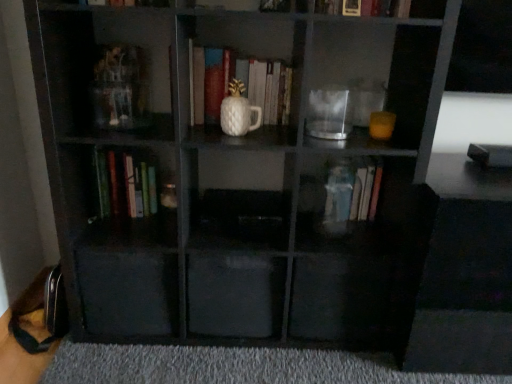
This screenshot has width=512, height=384. Identify the location of transparent plastic book at center, the first book positioned from the right. (353, 191).

The width and height of the screenshot is (512, 384). Describe the element at coordinates (230, 367) in the screenshot. I see `gray carpet at lower center` at that location.

The width and height of the screenshot is (512, 384). Identify the location of transparent plastic drawer at center, arranged as the 1th drawer when viewed from the right. (234, 295).

Considering the sizes of gray carpet at lower center and white matte vase at center, which is the second book from left to right, in the image, is gray carpet at lower center wider or thinner than white matte vase at center, which is the second book from left to right,?

In the image, gray carpet at lower center appears to be wider than white matte vase at center, which is the second book from left to right.

Looking at this image, from the image's perspective, who appears lower, gray carpet at lower center or white matte vase at center, acting as the third book starting from the right?

gray carpet at lower center.

Can you tell me how much gray carpet at lower center and white matte vase at center, which is the second book from left to right, differ in facing direction?

The angle between the facing direction of gray carpet at lower center and the facing direction of white matte vase at center, which is the second book from left to right, is 91.9 degrees.

Consider the image. Would you say gray carpet at lower center contains white matte vase at center, acting as the third book starting from the right?

That's incorrect, white matte vase at center, acting as the third book starting from the right, is not inside gray carpet at lower center.

Based on the photo, which of these two, hardcover book at upper center, positioned as the third book in left-to-right order, or transparent plastic drawer at lower left, which is the second drawer from right to left, stands taller?

With more height is transparent plastic drawer at lower left, which is the second drawer from right to left.

Identify the location of the 4th book directly above the transparent plastic drawer at lower left, which is the second drawer from right to left (from a real-world perspective). The width and height of the screenshot is (512, 384). (364, 7).

Is hardcover book at upper center, positioned as the third book in left-to-right order, not close to transparent plastic drawer at lower left, the 1th drawer when ordered from left to right?

That's right, there is a large distance between hardcover book at upper center, positioned as the third book in left-to-right order, and transparent plastic drawer at lower left, the 1th drawer when ordered from left to right.

In the scene shown: Does hardcover book at upper center, the second book from the right, have a smaller size compared to transparent plastic drawer at lower left, the 1th drawer when ordered from left to right?

Indeed, hardcover book at upper center, the second book from the right, has a smaller size compared to transparent plastic drawer at lower left, the 1th drawer when ordered from left to right.

Looking at this image, which point is more forward, (343, 124) or (155, 318)?

The point (343, 124) is closer to the camera.

How different are the orientations of transparent glass jar at center and transparent plastic drawer at lower left, which is the second drawer from right to left, in degrees?

They differ by 3.97 degrees in their facing directions.

Is transparent glass jar at center shorter than transparent plastic drawer at lower left, the 1th drawer when ordered from left to right?

Yes, transparent glass jar at center is shorter than transparent plastic drawer at lower left, the 1th drawer when ordered from left to right.

Starting from the transparent glass jar at center, which drawer is the 1st one behind? Please provide its 2D coordinates.

[(128, 292)]

Is transparent plastic book at center, the first book positioned from the right, touching white matte vase at center, acting as the third book starting from the right?

No, transparent plastic book at center, the first book positioned from the right, is not touching white matte vase at center, acting as the third book starting from the right.

Is transparent plastic book at center, the first book positioned from the right, oriented towards white matte vase at center, acting as the third book starting from the right?

No, transparent plastic book at center, the first book positioned from the right, does not turn towards white matte vase at center, acting as the third book starting from the right.

Is transparent plastic book at center, the first book positioned from the right, to the left or to the right of white matte vase at center, which is the second book from left to right, in the image?

transparent plastic book at center, the first book positioned from the right, is positioned on white matte vase at center, which is the second book from left to right,'s right side.

Consider the image. Considering the sizes of objects transparent plastic drawer at lower left, the 1th drawer when ordered from left to right, and transparent plastic book at center, the first book positioned from the right, in the image provided, who is taller, transparent plastic drawer at lower left, the 1th drawer when ordered from left to right, or transparent plastic book at center, the first book positioned from the right,?

Standing taller between the two is transparent plastic drawer at lower left, the 1th drawer when ordered from left to right.

Which object is further away from the camera, transparent plastic drawer at lower left, which is the second drawer from right to left, or transparent plastic book at center, the first book positioned from the right?

transparent plastic book at center, the first book positioned from the right, is more distant.

Is transparent plastic drawer at lower left, which is the second drawer from right to left, oriented away from transparent plastic book at center, the fourth book from the left?

That's not correct — transparent plastic drawer at lower left, which is the second drawer from right to left, is not looking away from transparent plastic book at center, the fourth book from the left.

This screenshot has width=512, height=384. In order to click on the 1st book above when counting from the transparent plastic drawer at lower left, the 1th drawer when ordered from left to right (from the image's perspective) in this screenshot , I will do `click(353, 191)`.

Can you confirm if transparent plastic drawer at center, arranged as the 1th drawer when viewed from the right, is wider than green matte book at lower left, the first book viewed from the left?

Yes, transparent plastic drawer at center, arranged as the 1th drawer when viewed from the right, is wider than green matte book at lower left, the first book viewed from the left.

Which is in front, transparent plastic drawer at center, the second drawer positioned from the left, or green matte book at lower left, the first book viewed from the left?

transparent plastic drawer at center, the second drawer positioned from the left, is closer to the camera.

Which is more to the right, transparent plastic drawer at center, arranged as the 1th drawer when viewed from the right, or green matte book at lower left, acting as the 4th book starting from the right?

transparent plastic drawer at center, arranged as the 1th drawer when viewed from the right.

From a real-world perspective, who is located lower, transparent plastic drawer at center, arranged as the 1th drawer when viewed from the right, or green matte book at lower left, the first book viewed from the left?

transparent plastic drawer at center, arranged as the 1th drawer when viewed from the right, is physically lower.

Are hardcover book at upper center, positioned as the third book in left-to-right order, and transparent plastic drawer at center, arranged as the 1th drawer when viewed from the right, located far from each other?

hardcover book at upper center, positioned as the third book in left-to-right order, is actually quite close to transparent plastic drawer at center, arranged as the 1th drawer when viewed from the right.

How different are the orientations of hardcover book at upper center, the second book from the right, and transparent plastic drawer at center, the second drawer positioned from the left, in degrees?

hardcover book at upper center, the second book from the right, and transparent plastic drawer at center, the second drawer positioned from the left, are facing 3.46 degrees away from each other.

From a real-world perspective, who is located higher, hardcover book at upper center, the second book from the right, or transparent plastic drawer at center, the second drawer positioned from the left?

hardcover book at upper center, the second book from the right, from a real-world perspective.

Can you confirm if hardcover book at upper center, the second book from the right, is positioned to the right of transparent plastic drawer at center, the second drawer positioned from the left?

Correct, you'll find hardcover book at upper center, the second book from the right, to the right of transparent plastic drawer at center, the second drawer positioned from the left.

Identify the location of the 1st book to the left when counting from the gray carpet at lower center. (267, 88).

From a real-world perspective, count 2nd drawers downward from the hardcover book at upper center, the second book from the right, and point to it. Please provide its 2D coordinates.

[(128, 292)]

Considering their positions, is transparent plastic drawer at center, arranged as the 1th drawer when viewed from the right, positioned closer to hardcover book at upper center, the second book from the right, than gray carpet at lower center?

The object closer to hardcover book at upper center, the second book from the right, is transparent plastic drawer at center, arranged as the 1th drawer when viewed from the right.

Which object lies further to the anchor point gray carpet at lower center, hardcover book at upper center, positioned as the third book in left-to-right order, or transparent plastic drawer at center, the second drawer positioned from the left?

Among the two, hardcover book at upper center, positioned as the third book in left-to-right order, is located further to gray carpet at lower center.

From the image, which object appears to be farther from gray carpet at lower center, transparent plastic book at center, the first book positioned from the right, or transparent glass jar at center?

Among the two, transparent glass jar at center is located further to gray carpet at lower center.

Based on their spatial positions, is hardcover book at upper center, positioned as the third book in left-to-right order, or white matte vase at center, acting as the third book starting from the right, closer to transparent plastic book at center, the fourth book from the left?

white matte vase at center, acting as the third book starting from the right, lies closer to transparent plastic book at center, the fourth book from the left, than the other object.

Considering their positions, is white matte vase at center, acting as the third book starting from the right, positioned further to green matte book at lower left, the first book viewed from the left, than transparent plastic drawer at center, the second drawer positioned from the left?

white matte vase at center, acting as the third book starting from the right.

Consider the image. Considering their positions, is green matte book at lower left, acting as the 4th book starting from the right, positioned further to hardcover book at upper center, the second book from the right, than transparent plastic drawer at lower left, which is the second drawer from right to left?

Among the two, transparent plastic drawer at lower left, which is the second drawer from right to left, is located further to hardcover book at upper center, the second book from the right.

From the image, which object appears to be farther from hardcover book at upper center, the second book from the right, transparent glass jar at center or green matte book at lower left, acting as the 4th book starting from the right?

Among the two, green matte book at lower left, acting as the 4th book starting from the right, is located further to hardcover book at upper center, the second book from the right.

In the scene shown: Based on their spatial positions, is white matte vase at center, which is the second book from left to right, or transparent glass jar at center closer to hardcover book at upper center, the second book from the right?

The object closer to hardcover book at upper center, the second book from the right, is transparent glass jar at center.

The height and width of the screenshot is (384, 512). Identify the location of drawer between hardcover book at upper center, the second book from the right, and transparent plastic drawer at center, the second drawer positioned from the left, in the vertical direction. (128, 292).

Locate an element on the screen. drawer that lies between white matte vase at center, acting as the third book starting from the right, and transparent plastic drawer at center, arranged as the 1th drawer when viewed from the right, from top to bottom is located at coordinates (128, 292).

Identify the location of glass jar between hardcover book at upper center, positioned as the third book in left-to-right order, and transparent plastic book at center, the first book positioned from the right, in the up-down direction. (328, 114).

Locate an element on the screen. This screenshot has width=512, height=384. glass jar that lies between white matte vase at center, acting as the third book starting from the right, and gray carpet at lower center from top to bottom is located at coordinates (328, 114).